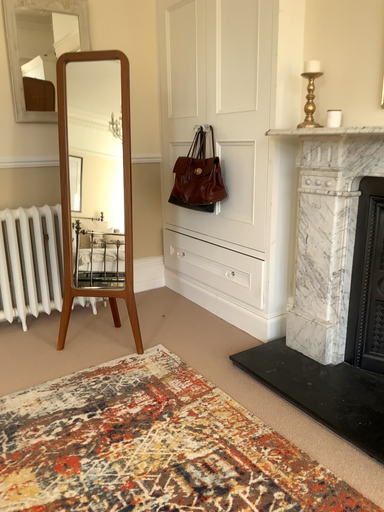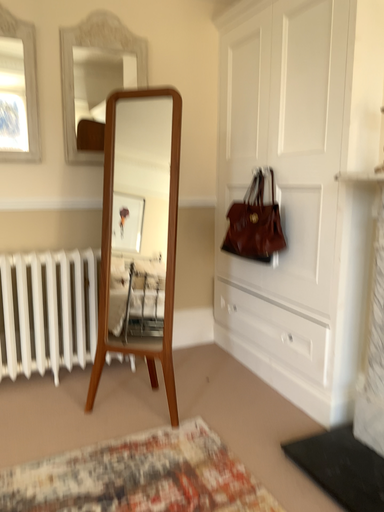
Question: How did the camera likely rotate when shooting the video?

Choices:
 (A) rotated left
 (B) rotated right

Answer: (A)